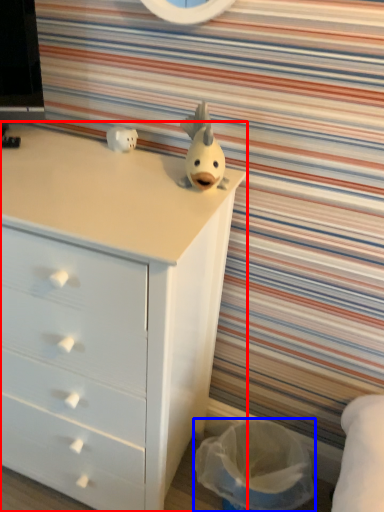
Question: Which object appears farthest to the camera in this image, chest of drawers (highlighted by a red box) or laundry basket (highlighted by a blue box)?

Choices:
 (A) chest of drawers
 (B) laundry basket

Answer: (B)